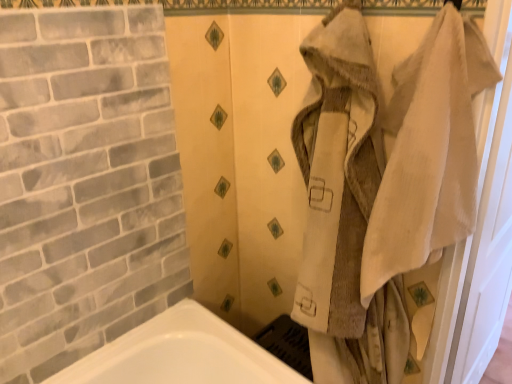
Question: Is beige fabric screen door at right taller or shorter than white textured towel at right?

Choices:
 (A) short
 (B) tall

Answer: (B)

Question: From a real-world perspective, relative to white textured towel at right, is beige fabric screen door at right vertically above or below?

Choices:
 (A) above
 (B) below

Answer: (B)

Question: Visually, is beige fabric screen door at right positioned to the left or to the right of white textured towel at right?

Choices:
 (A) left
 (B) right

Answer: (B)

Question: Is white textured towel at right inside or outside of beige fabric screen door at right?

Choices:
 (A) inside
 (B) outside

Answer: (B)

Question: From a real-world perspective, relative to beige fabric screen door at right, is white textured towel at right vertically above or below?

Choices:
 (A) above
 (B) below

Answer: (A)

Question: Considering the positions of white textured towel at right and beige fabric screen door at right in the image, is white textured towel at right taller or shorter than beige fabric screen door at right?

Choices:
 (A) tall
 (B) short

Answer: (B)

Question: From the image's perspective, is white textured towel at right positioned above or below beige fabric screen door at right?

Choices:
 (A) above
 (B) below

Answer: (A)